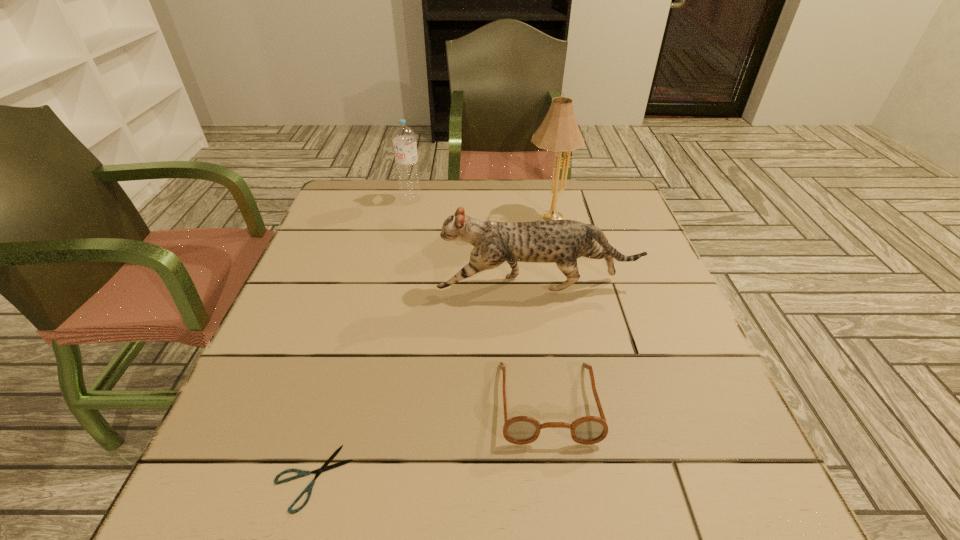
The width and height of the screenshot is (960, 540). In order to click on vacant space at the right edge of the desktop in this screenshot , I will do `click(611, 236)`.

The height and width of the screenshot is (540, 960). Find the location of `vacant area at the far left corner`. vacant area at the far left corner is located at coordinates (355, 179).

Where is `vacant space at the near left corner of the desktop`? The image size is (960, 540). vacant space at the near left corner of the desktop is located at coordinates pos(233,486).

This screenshot has height=540, width=960. In the image, there is a desktop. In order to click on vacant space at the far right corner in this screenshot , I will do `click(608, 198)`.

Locate an element on the screen. This screenshot has width=960, height=540. vacant space that's between the lampshade and the fourth tallest object is located at coordinates (548, 308).

The width and height of the screenshot is (960, 540). I want to click on vacant space that is in between the third shortest object and the shears, so [x=425, y=382].

Locate an element on the screen. vacant space in between the third tallest object and the fourth tallest object is located at coordinates (542, 344).

Locate an element on the screen. Image resolution: width=960 pixels, height=540 pixels. free point between the shortest object and the tallest object is located at coordinates [431, 346].

I want to click on vacant space that is in between the shears and the third shortest object, so click(x=425, y=382).

What are the coordinates of `free area in between the third shortest object and the spectacles` in the screenshot? It's located at (542, 344).